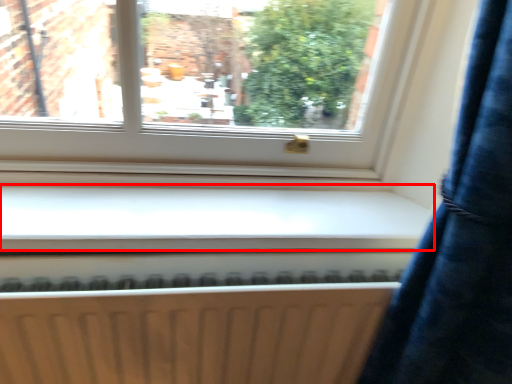
Question: From the image's perspective, where is window sill (annotated by the red box) located in relation to radiator in the image?

Choices:
 (A) above
 (B) below

Answer: (A)